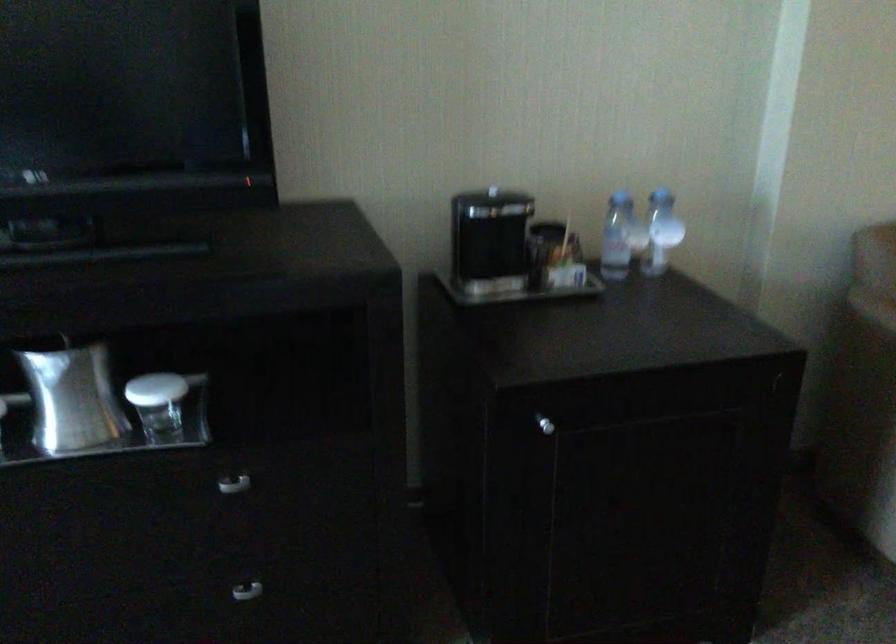
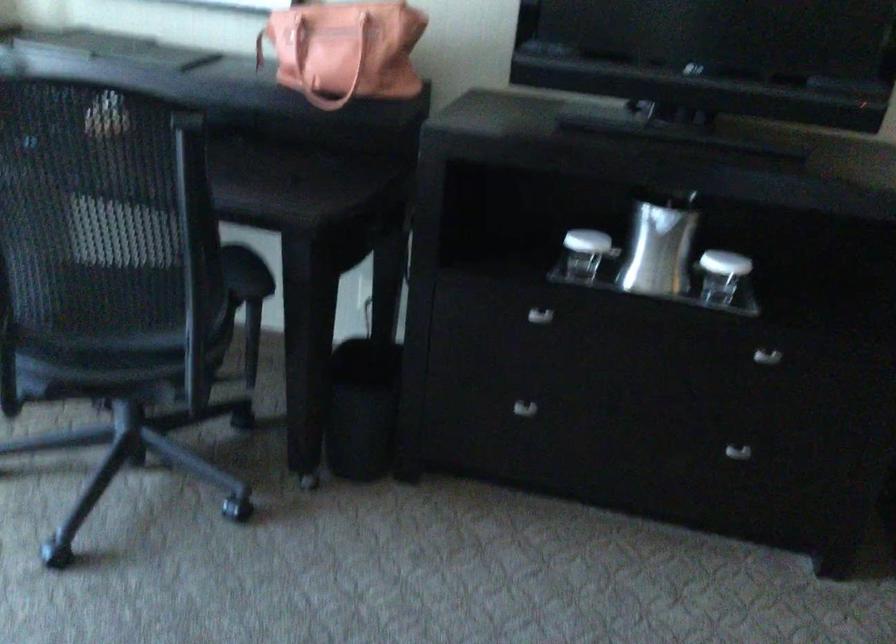
The point at (234, 488) is marked in the first image. Where is the corresponding point in the second image?

(767, 357)